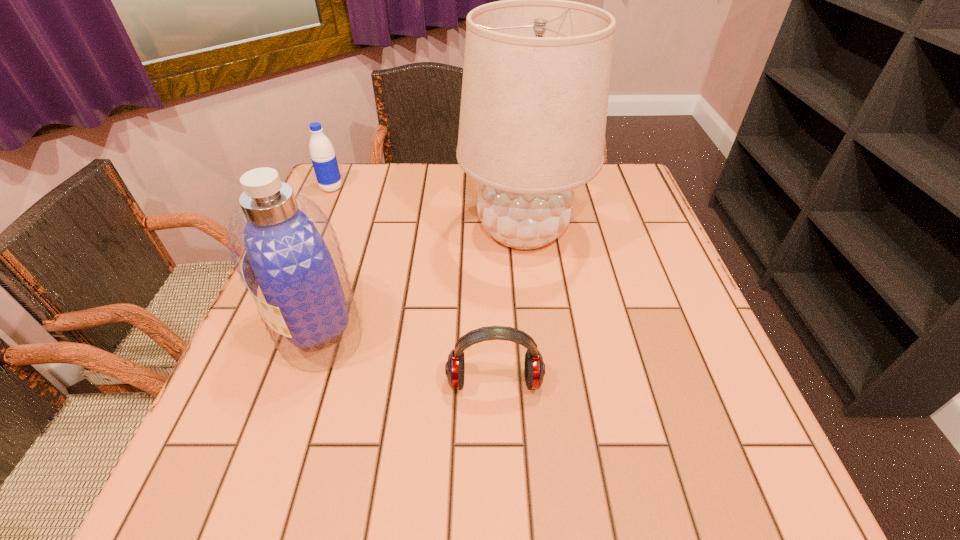
You are a GUI agent. You are given a task and a screenshot of the screen. Output one action in this format:
    pyautogui.click(x=<x>, y=<y>)
    Task: Click on the tallest object
    The height and width of the screenshot is (540, 960).
    Given the screenshot: What is the action you would take?
    pyautogui.click(x=536, y=76)

This screenshot has height=540, width=960. What are the coordinates of `the third nearest object` in the screenshot? It's located at (536, 76).

At what (x,y) coordinates should I click in order to perform the action: click on the third shortest object. Please return your answer as a coordinate pair (x, y). Looking at the image, I should click on (282, 244).

Where is `water bottle`? The image size is (960, 540). water bottle is located at coordinates (323, 157).

You are a GUI agent. You are given a task and a screenshot of the screen. Output one action in this format:
    pyautogui.click(x=<x>, y=<y>)
    Task: Click on the second shortest object
    This screenshot has height=540, width=960.
    Given the screenshot: What is the action you would take?
    pyautogui.click(x=323, y=157)

At what (x,y) coordinates should I click in order to perform the action: click on the shortest object. Please return your answer as a coordinate pair (x, y). The width and height of the screenshot is (960, 540). Looking at the image, I should click on pos(534,366).

Where is `vacant space located on the front of the tallest object`? vacant space located on the front of the tallest object is located at coordinates (535, 339).

The width and height of the screenshot is (960, 540). What are the coordinates of `vacant region located 0.320m on the right of the cleansing agent` in the screenshot? It's located at (529, 328).

The height and width of the screenshot is (540, 960). Find the location of `vacant space positioned 0.120m on the right of the farthest object`. vacant space positioned 0.120m on the right of the farthest object is located at coordinates [386, 188].

Find the location of a particular element. blank space located on the ear cups of the earphone is located at coordinates (498, 496).